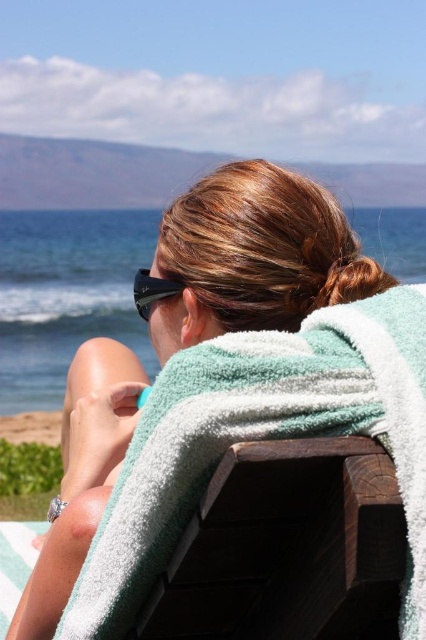
Question: Which of the following is the farthest from the observer?

Choices:
 (A) black matte sunglasses at center
 (B) green towel at center

Answer: (A)

Question: Among these objects, which one is farthest from the camera?

Choices:
 (A) green towel at center
 (B) black matte sunglasses at center

Answer: (B)

Question: Is green towel at center bigger than black matte sunglasses at center?

Choices:
 (A) no
 (B) yes

Answer: (B)

Question: Is green towel at center below black matte sunglasses at center?

Choices:
 (A) no
 (B) yes

Answer: (B)

Question: Does green towel at center have a larger size compared to black matte sunglasses at center?

Choices:
 (A) yes
 (B) no

Answer: (A)

Question: Which object is farther from the camera taking this photo?

Choices:
 (A) green towel at center
 (B) black matte sunglasses at center

Answer: (B)